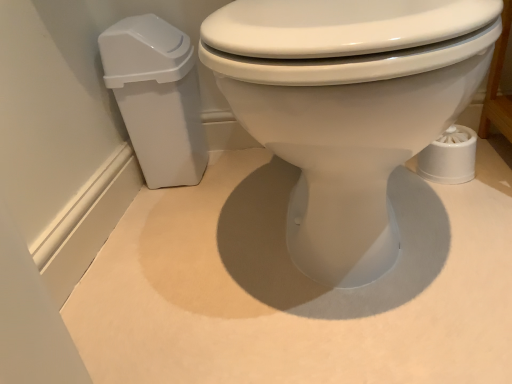
In order to face white plastic trash can at left, should I rotate leftwards or rightwards?

Rotate your view left by about 11.721°.

At what (x,y) coordinates should I click in order to perform the action: click on white plastic trash can at left. Please return your answer as a coordinate pair (x, y). The image size is (512, 384). Looking at the image, I should click on (157, 97).

The width and height of the screenshot is (512, 384). Describe the element at coordinates (157, 97) in the screenshot. I see `white plastic trash can at left` at that location.

Describe the element at coordinates (347, 107) in the screenshot. I see `white glossy toilet at center` at that location.

You are a GUI agent. You are given a task and a screenshot of the screen. Output one action in this format:
    pyautogui.click(x=<x>, y=<y>)
    Task: Click on the white glossy toilet at center
    This screenshot has width=512, height=384.
    Given the screenshot: What is the action you would take?
    tap(347, 107)

At what (x,y) coordinates should I click in order to perform the action: click on white plastic trash can at left. Please return your answer as a coordinate pair (x, y). This screenshot has width=512, height=384. Looking at the image, I should click on (157, 97).

Which object is positioned more to the right, white glossy toilet at center or white plastic trash can at left?

white glossy toilet at center is more to the right.

Is white glossy toilet at center in front of white plastic trash can at left?

Yes, white glossy toilet at center is closer to the camera.

Considering the points (318, 189) and (198, 133), which point is in front, point (318, 189) or point (198, 133)?

The point (318, 189) is more forward.

From the image's perspective, is white glossy toilet at center beneath white plastic trash can at left?

Indeed, from the image's perspective, white glossy toilet at center is shown beneath white plastic trash can at left.

From a real-world perspective, between white glossy toilet at center and white plastic trash can at left, who is vertically lower?

From a 3D spatial view, white plastic trash can at left is below.

Is white glossy toilet at center thinner than white plastic trash can at left?

In fact, white glossy toilet at center might be wider than white plastic trash can at left.

Which of these two, white glossy toilet at center or white plastic trash can at left, stands shorter?

With less height is white plastic trash can at left.

Is white glossy toilet at center smaller than white plastic trash can at left?

No.

Which is correct: white glossy toilet at center is inside white plastic trash can at left, or outside of it?

white glossy toilet at center is not enclosed by white plastic trash can at left.

From the picture: Would you consider white glossy toilet at center to be distant from white plastic trash can at left?

No, white glossy toilet at center is in close proximity to white plastic trash can at left.

Is white glossy toilet at center looking in the opposite direction of white plastic trash can at left?

That's not correct — white glossy toilet at center is not looking away from white plastic trash can at left.

In the scene shown: How far apart are white glossy toilet at center and white plastic trash can at left?

They are 17.22 inches apart.

At what (x,y) coordinates should I click in order to perform the action: click on porcelain behind the white glossy toilet at center. Please return your answer as a coordinate pair (x, y). The width and height of the screenshot is (512, 384). Looking at the image, I should click on (157, 97).

Is white plastic trash can at left at the right side of white glossy toilet at center?

In fact, white plastic trash can at left is to the left of white glossy toilet at center.

Considering their positions, is white plastic trash can at left located in front of or behind white glossy toilet at center?

In the image, white plastic trash can at left appears behind white glossy toilet at center.

Which is closer, (179, 87) or (291, 83)?

Clearly, point (179, 87) is more distant from the camera than point (291, 83).

From the image's perspective, which is above, white plastic trash can at left or white glossy toilet at center?

white plastic trash can at left, from the image's perspective.

From a real-world perspective, is white plastic trash can at left located beneath white glossy toilet at center?

Correct, in the physical world, white plastic trash can at left is lower than white glossy toilet at center.

In terms of width, does white plastic trash can at left look wider or thinner when compared to white glossy toilet at center?

Considering their sizes, white plastic trash can at left looks slimmer than white glossy toilet at center.

Who is taller, white plastic trash can at left or white glossy toilet at center?

With more height is white glossy toilet at center.

Looking at the image, does white plastic trash can at left seem bigger or smaller compared to white glossy toilet at center?

Considering their sizes, white plastic trash can at left takes up less space than white glossy toilet at center.

Can white glossy toilet at center be found inside white plastic trash can at left?

A: Definitely not — white glossy toilet at center is not inside white plastic trash can at left.

Is white plastic trash can at left placed right next to white glossy toilet at center?

No.

Is white plastic trash can at left positioned with its back to white glossy toilet at center?

No, white plastic trash can at left is not facing away from white glossy toilet at center.

How much distance is there between white plastic trash can at left and white glossy toilet at center?

white plastic trash can at left is 17.22 inches away from white glossy toilet at center.

There is a white plastic trash can at left. Where is `toilet above it (from a real-world perspective)`? toilet above it (from a real-world perspective) is located at coordinates (347, 107).

There is a white plastic trash can at left. Where is `toilet above it (from a real-world perspective)`? This screenshot has height=384, width=512. toilet above it (from a real-world perspective) is located at coordinates (347, 107).

The height and width of the screenshot is (384, 512). I want to click on toilet in front of the white plastic trash can at left, so click(347, 107).